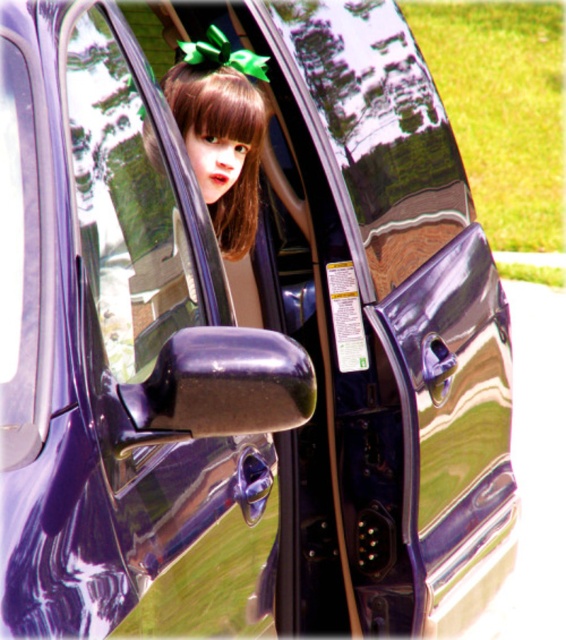
Which of these two, transparent plastic car window at center or matte brown hair at center, stands taller?

With more height is transparent plastic car window at center.

Can you confirm if transparent plastic car window at center is bigger than matte brown hair at center?

Indeed, transparent plastic car window at center has a larger size compared to matte brown hair at center.

The image size is (566, 640). Describe the element at coordinates (125, 205) in the screenshot. I see `transparent plastic car window at center` at that location.

Identify the location of transparent plastic car window at center. The width and height of the screenshot is (566, 640). (125, 205).